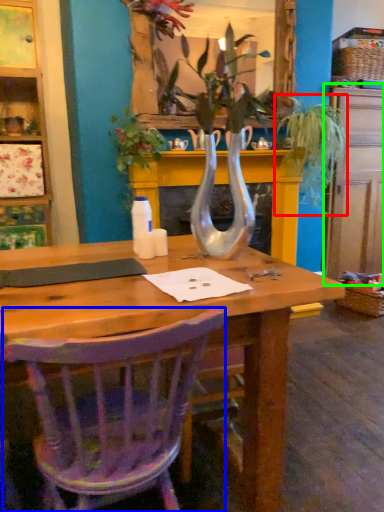
Question: Based on their relative distances, which object is nearer to houseplant (highlighted by a red box)? Choose from chair (highlighted by a blue box) and dresser (highlighted by a green box).

Choices:
 (A) chair
 (B) dresser

Answer: (B)